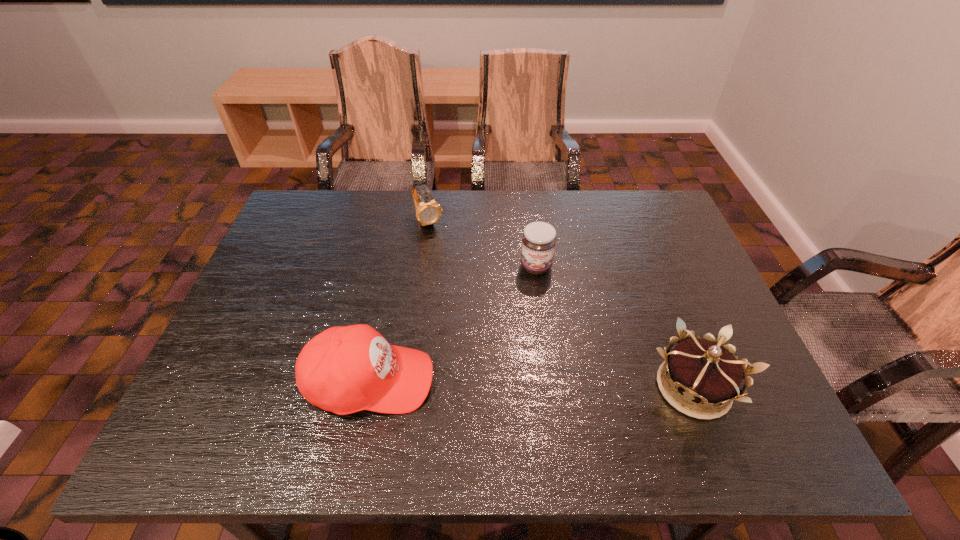
The height and width of the screenshot is (540, 960). In the image, there is a desktop. Identify the location of vacant space at the left edge. (276, 287).

The width and height of the screenshot is (960, 540). In the image, there is a desktop. In order to click on vacant space at the right edge in this screenshot , I will do click(x=672, y=333).

Find the location of `vacant space at the near left corner of the desktop`. vacant space at the near left corner of the desktop is located at coordinates (237, 389).

Identify the location of free space at the far right corner of the desktop. This screenshot has width=960, height=540. [x=660, y=194].

Identify the location of free space between the third nearest object and the farthest object. This screenshot has height=540, width=960. (482, 244).

Identify the location of empty space that is in between the baseball cap and the jam. (453, 323).

Identify the location of free space between the third nearest object and the baseball cap. (453, 323).

Where is `vacant area that lies between the watch and the second object from right to left`? The height and width of the screenshot is (540, 960). vacant area that lies between the watch and the second object from right to left is located at coordinates (482, 244).

Where is `vacant area that lies between the watch and the baseball cap`? vacant area that lies between the watch and the baseball cap is located at coordinates (399, 301).

This screenshot has height=540, width=960. In order to click on empty location between the crown and the baseball cap in this screenshot , I will do `click(532, 384)`.